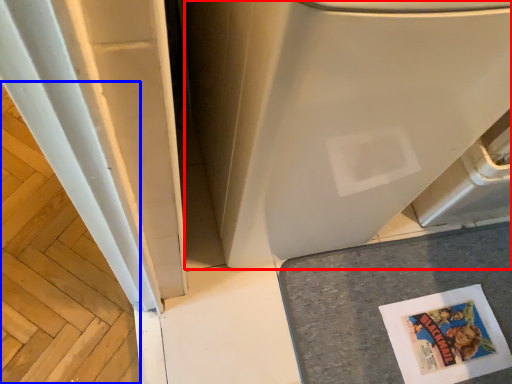
Question: Which object is further to the camera taking this photo, water heater (highlighted by a red box) or wood (highlighted by a blue box)?

Choices:
 (A) water heater
 (B) wood

Answer: (B)